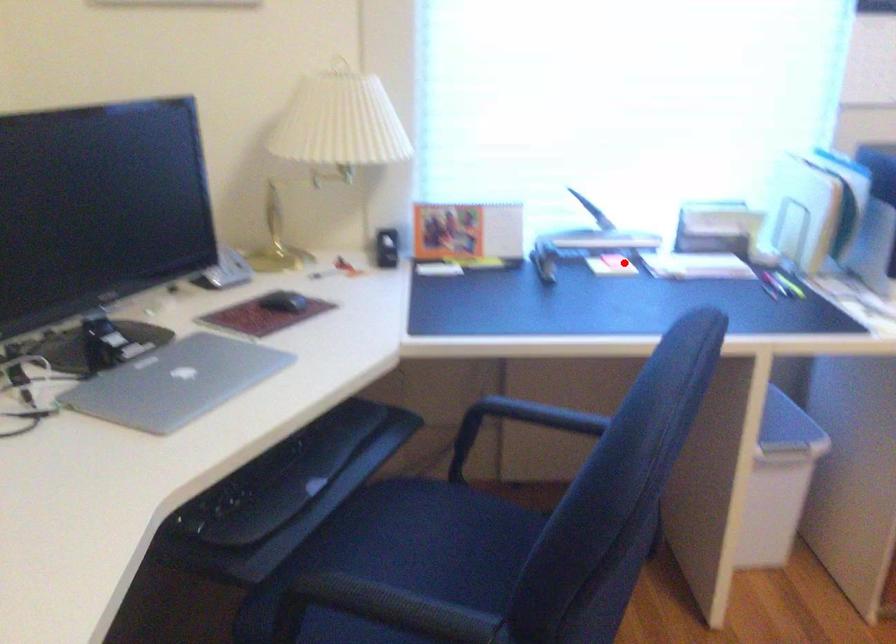
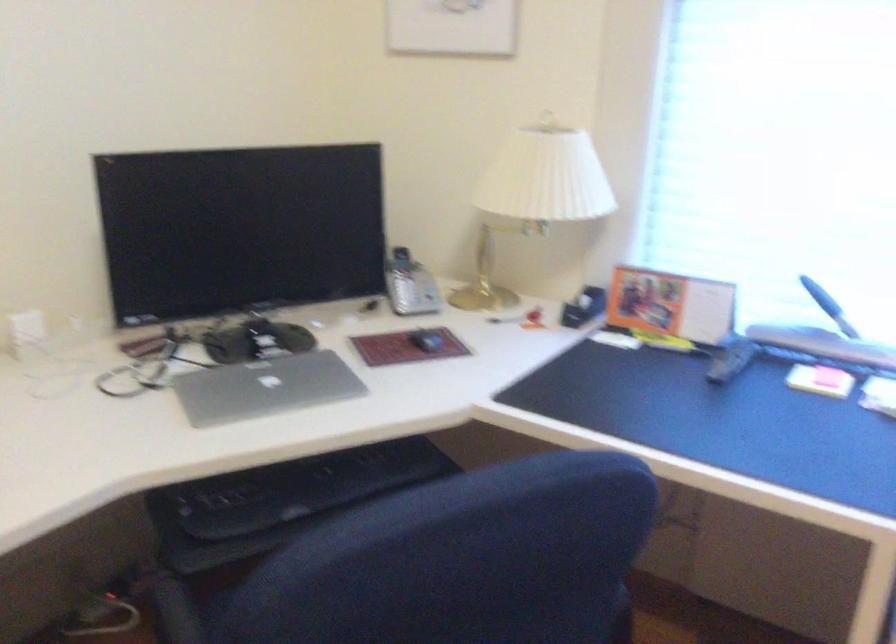
Locate, in the second image, the point that corresponds to the highlighted location in the first image.

(829, 377)